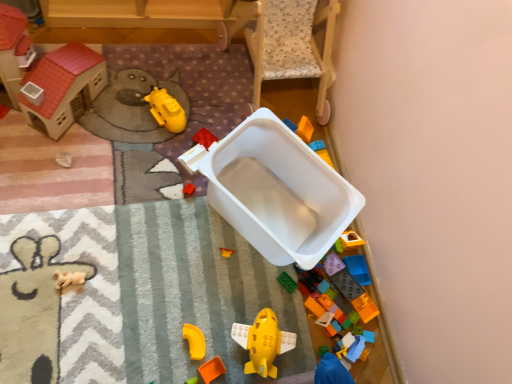
Question: Is white plastic container at center, the 9th toy from the right, smaller than green matte toy at lower right, which is the fourth toy in right-to-left order?

Choices:
 (A) no
 (B) yes

Answer: (A)

Question: From the image's perspective, is white plastic container at center, the 9th toy from the right, below green matte toy at lower right, which is the fourth toy in right-to-left order?

Choices:
 (A) no
 (B) yes

Answer: (A)

Question: Does white plastic container at center, which is the 3th toy in left-to-right order, have a larger size compared to green matte toy at lower right, which is the fourth toy in right-to-left order?

Choices:
 (A) no
 (B) yes

Answer: (B)

Question: Does white plastic container at center, the 9th toy from the right, turn towards green matte toy at lower right, which is the fourth toy in right-to-left order?

Choices:
 (A) yes
 (B) no

Answer: (B)

Question: Is white plastic container at center, the 9th toy from the right, positioned behind green matte toy at lower right, the eighth toy positioned from the left?

Choices:
 (A) no
 (B) yes

Answer: (B)

Question: Does white plastic container at center, the 9th toy from the right, appear on the right side of green matte toy at lower right, the eighth toy positioned from the left?

Choices:
 (A) yes
 (B) no

Answer: (B)

Question: Can you confirm if orange plastic toy at lower center, placed as the sixth toy when sorted from left to right, is shorter than white plastic container at center?

Choices:
 (A) no
 (B) yes

Answer: (B)

Question: Is white plastic container at center a part of orange plastic toy at lower center, placed as the sixth toy when sorted from left to right?

Choices:
 (A) no
 (B) yes

Answer: (A)

Question: Is orange plastic toy at lower center, placed as the sixth toy when sorted from left to right, facing away from white plastic container at center?

Choices:
 (A) yes
 (B) no

Answer: (B)

Question: From the image's perspective, does orange plastic toy at lower center, which ranks as the 6th toy in right-to-left order, appear higher than white plastic container at center?

Choices:
 (A) yes
 (B) no

Answer: (B)

Question: Is orange plastic toy at lower center, placed as the sixth toy when sorted from left to right, positioned in front of white plastic container at center?

Choices:
 (A) no
 (B) yes

Answer: (A)

Question: Can you confirm if orange plastic toy at lower center, placed as the sixth toy when sorted from left to right, is wider than white plastic container at center?

Choices:
 (A) yes
 (B) no

Answer: (B)

Question: Could bright orange plastic blocks at lower right, which is the eleventh toy from left to right, be considered to be inside green matte toy at lower right, the eighth toy positioned from the left?

Choices:
 (A) no
 (B) yes

Answer: (A)